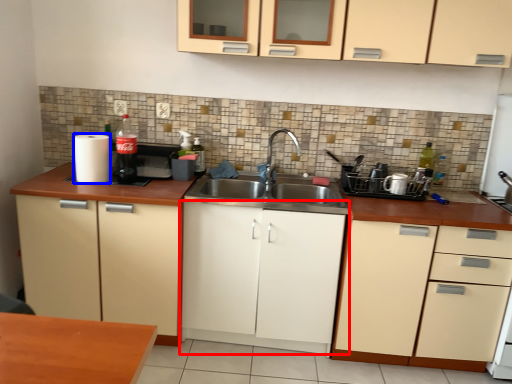
Question: Which point is further to the camera, cabinetry (highlighted by a red box) or paper towel (highlighted by a blue box)?

Choices:
 (A) cabinetry
 (B) paper towel

Answer: (B)